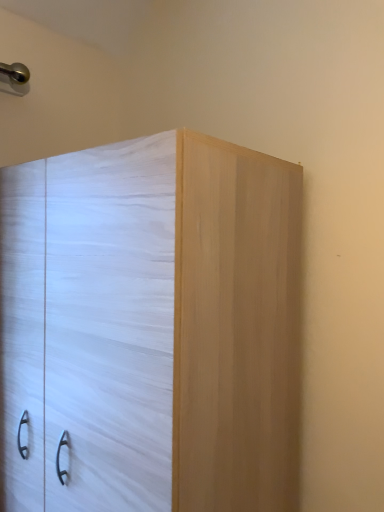
This screenshot has width=384, height=512. What do you see at coordinates (151, 328) in the screenshot?
I see `white wood cupboard at center` at bounding box center [151, 328].

You are a GUI agent. You are given a task and a screenshot of the screen. Output one action in this format:
    pyautogui.click(x=<x>, y=<y>)
    Task: Click on the white wood cupboard at center
    This screenshot has width=384, height=512.
    Given the screenshot: What is the action you would take?
    pyautogui.click(x=151, y=328)

Locate an element on the screen. white wood cupboard at center is located at coordinates (151, 328).